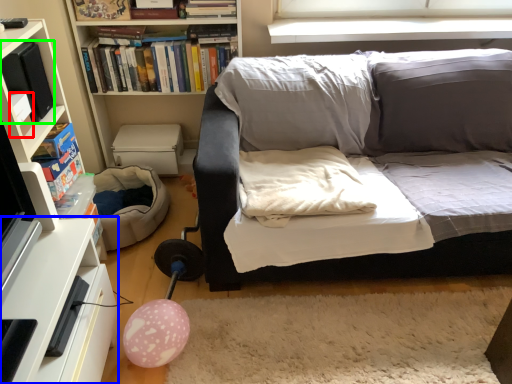
Question: Estimate the real-world distances between objects in this image. Which object is farther from paperback book (highlighted by a red box), table (highlighted by a blue box) or paperback book (highlighted by a green box)?

Choices:
 (A) table
 (B) paperback book

Answer: (A)